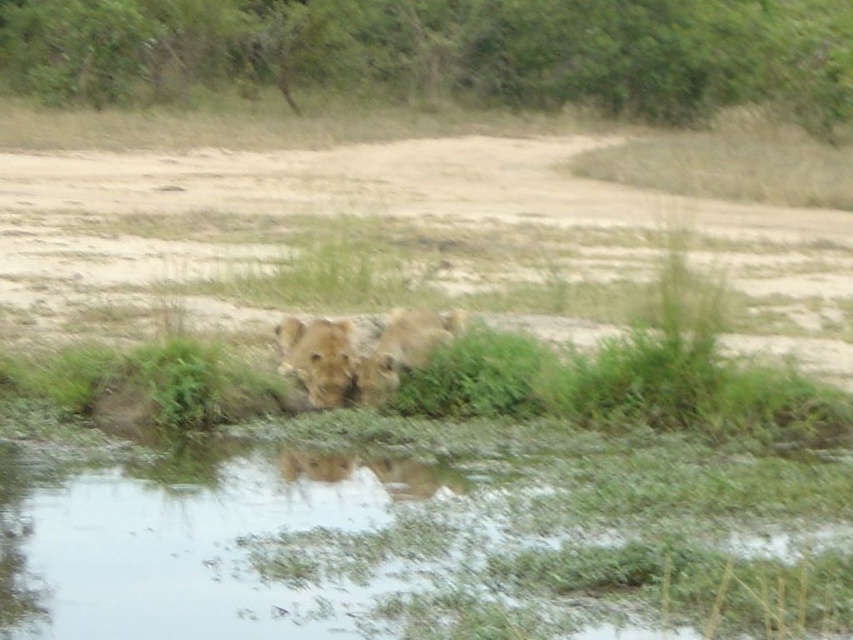
Does fuzzy golden lion at center have a lesser height compared to golden fur lion at center?

Yes, fuzzy golden lion at center is shorter than golden fur lion at center.

Does fuzzy golden lion at center appear on the left side of golden fur lion at center?

Yes, fuzzy golden lion at center is to the left of golden fur lion at center.

Is point (300, 362) positioned after point (407, 364)?

That is True.

Find the location of a particular element. fuzzy golden lion at center is located at coordinates (318, 356).

Does clear water at lower center have a lesser height compared to fuzzy golden lion at center?

Yes, clear water at lower center is shorter than fuzzy golden lion at center.

What do you see at coordinates (399, 548) in the screenshot? I see `clear water at lower center` at bounding box center [399, 548].

In order to click on clear water at lower center in this screenshot , I will do `click(399, 548)`.

Does point (473, 609) lie in front of point (447, 340)?

Yes, it is.

Does clear water at lower center have a greater width compared to golden fur lion at center?

Yes.

This screenshot has height=640, width=853. In order to click on clear water at lower center in this screenshot , I will do `click(399, 548)`.

Image resolution: width=853 pixels, height=640 pixels. What are the coordinates of `clear water at lower center` in the screenshot? It's located at (399, 548).